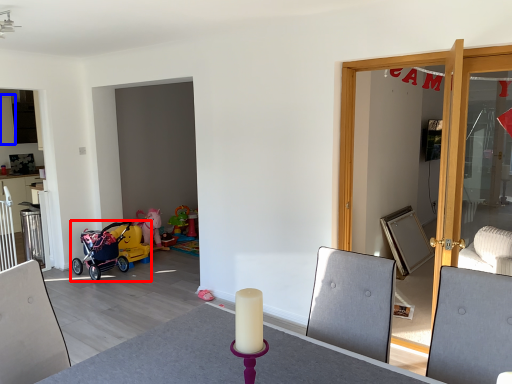
Question: Which object is closer to the camera taking this photo, stroller (highlighted by a red box) or cabinetry (highlighted by a blue box)?

Choices:
 (A) stroller
 (B) cabinetry

Answer: (A)